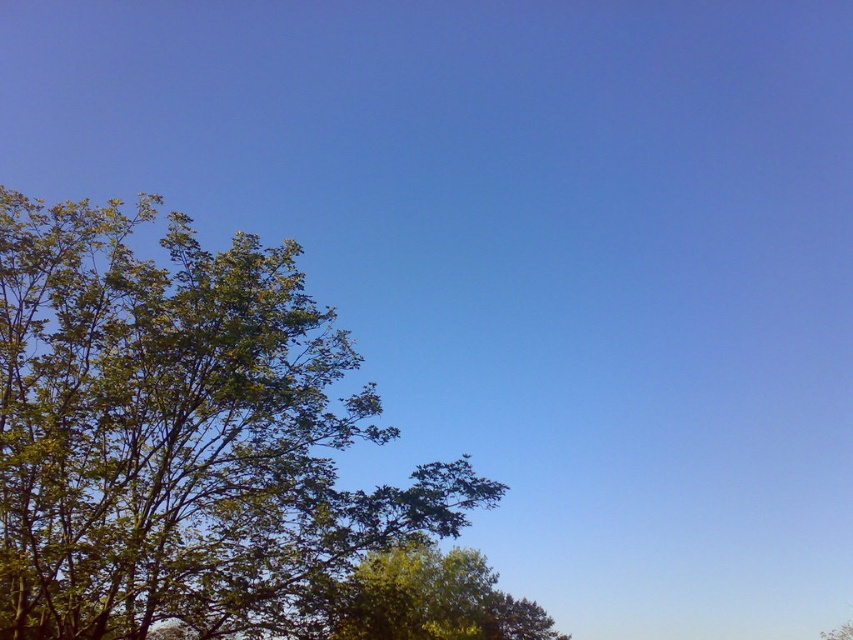
Is green leafy tree at left to the left of green leafy tree at lower center from the viewer's perspective?

Indeed, green leafy tree at left is positioned on the left side of green leafy tree at lower center.

Is green leafy tree at left below green leafy tree at lower center?

No.

Where is `green leafy tree at left`? This screenshot has width=853, height=640. green leafy tree at left is located at coordinates (178, 433).

You are a GUI agent. You are given a task and a screenshot of the screen. Output one action in this format:
    pyautogui.click(x=<x>, y=<y>)
    Task: Click on the green leafy tree at left
    The width and height of the screenshot is (853, 640).
    Given the screenshot: What is the action you would take?
    pyautogui.click(x=178, y=433)